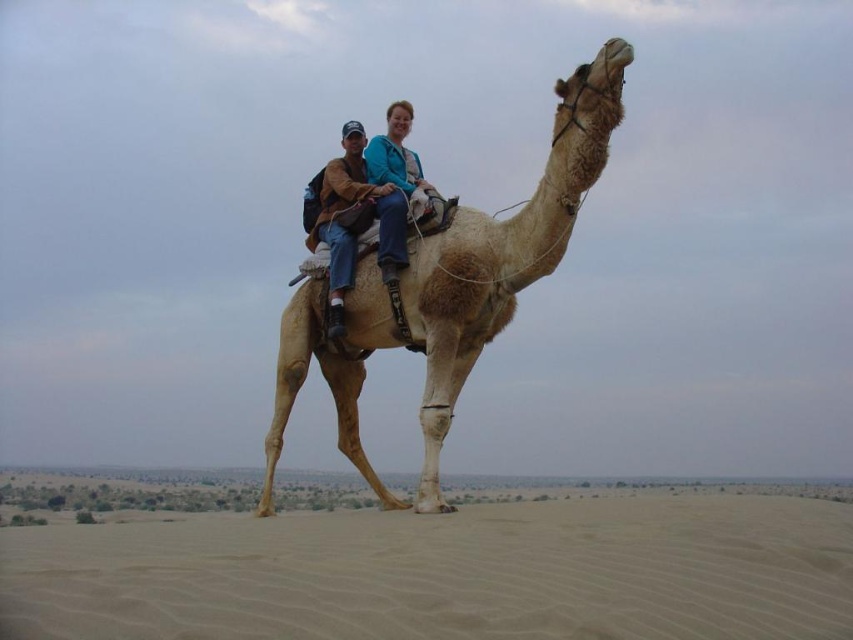
You are a photographer trying to capture a photo of the light beige textured camel at center and the matte brown leather saddle at center. Which object should you focus on first if you want to ensure both are in focus, considering their positions?

The light beige textured camel at center is below the matte brown leather saddle at center, so you should focus on the matte brown leather saddle at center first to ensure both are in focus.